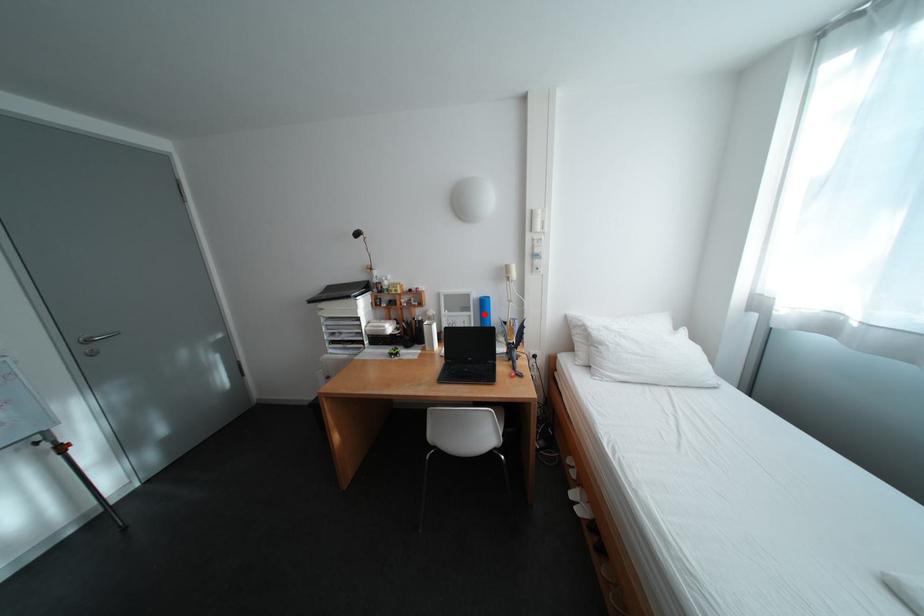
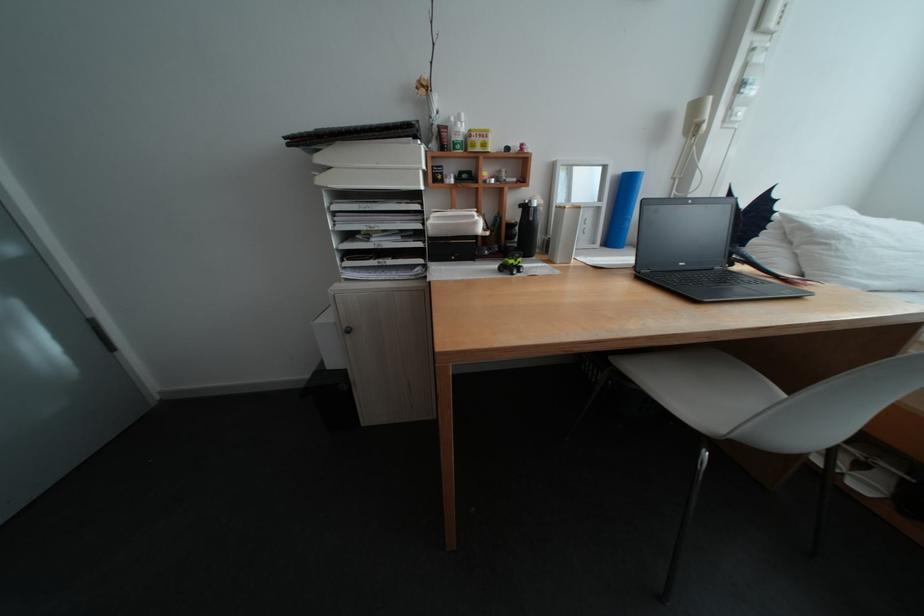
The point at the highlighted location is marked in the first image. Where is the corresponding point in the second image?

(616, 205)